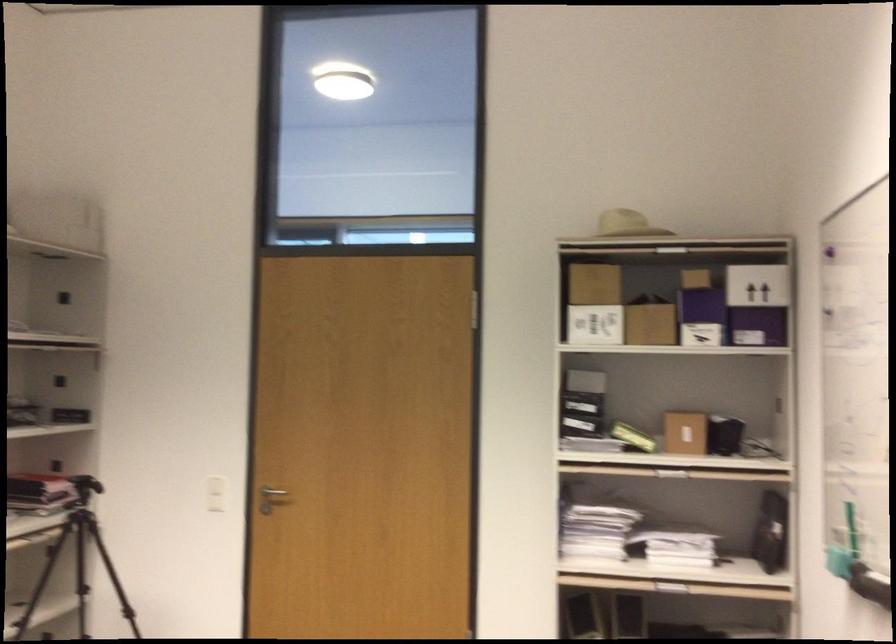
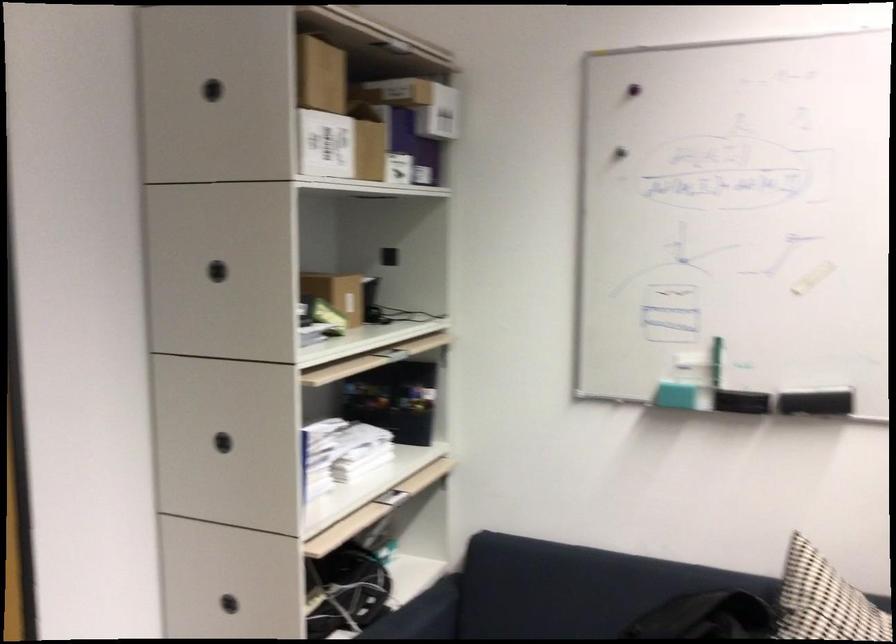
Where in the second image is the point corresponding to (x=578, y=397) from the first image?

(217, 270)